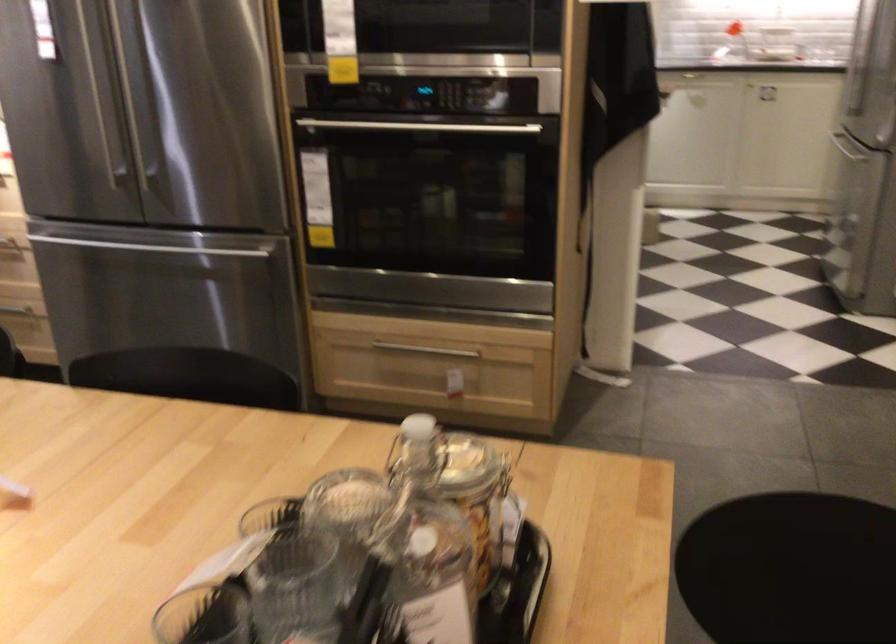
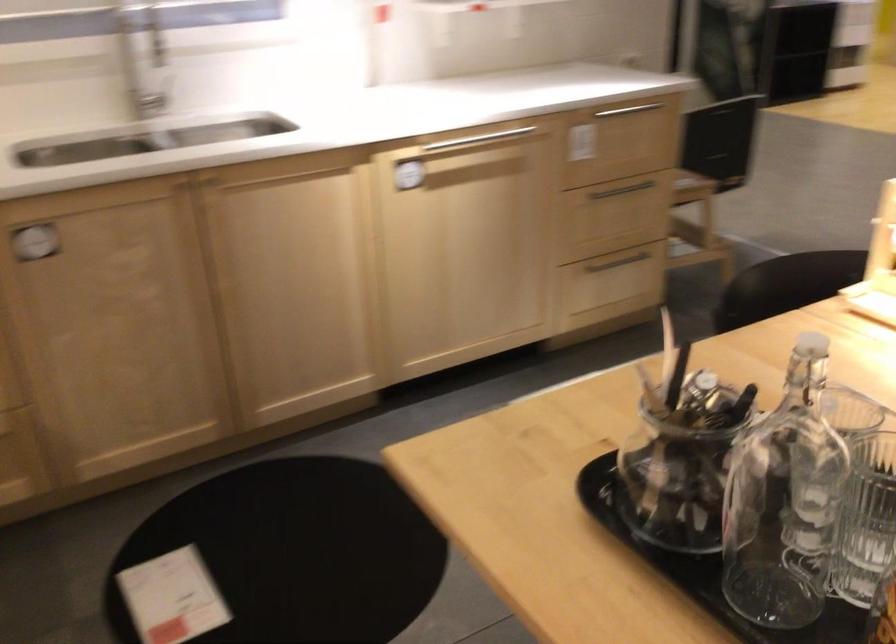
In the second image, find the point that corresponds to (420,424) in the first image.

(814, 351)